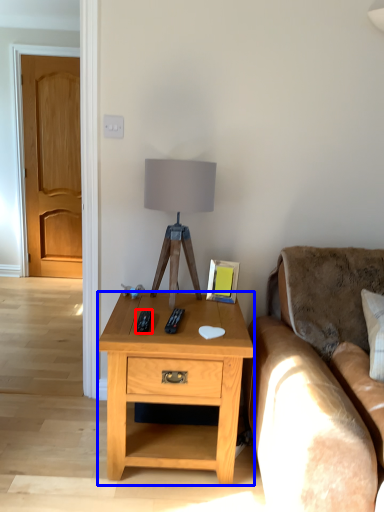
Question: Which object is further to the camera taking this photo, remote (highlighted by a red box) or desk (highlighted by a blue box)?

Choices:
 (A) remote
 (B) desk

Answer: (A)